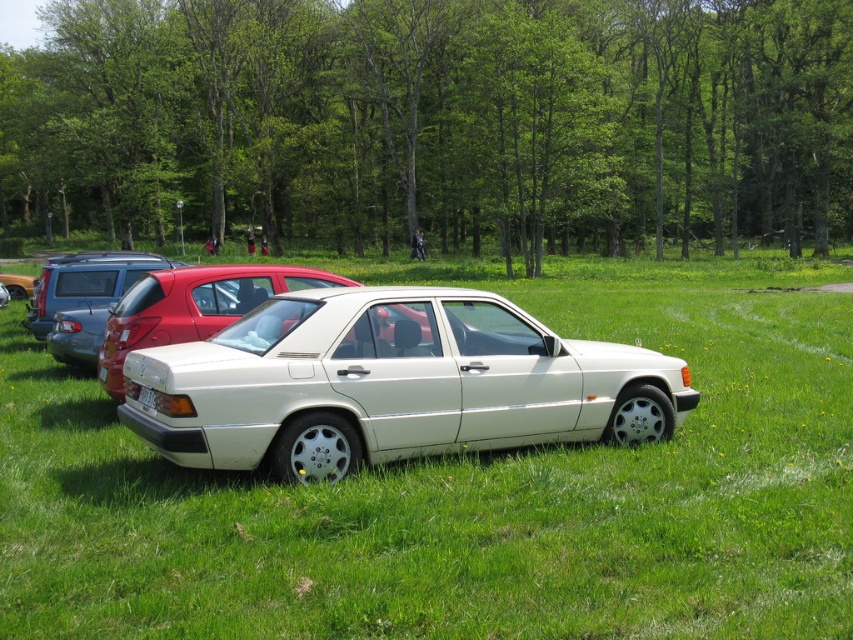
Question: Can you confirm if matte black hatchback at left is positioned to the right of white plastic license plate at center?

Choices:
 (A) no
 (B) yes

Answer: (A)

Question: Is white glossy sedan at center bigger than white metallic sedan at center?

Choices:
 (A) no
 (B) yes

Answer: (B)

Question: Estimate the real-world distances between objects in this image. Which object is closer to the satin white sedan at center?

Choices:
 (A) white metallic sedan at center
 (B) white plastic license plate at center
 (C) white glossy sedan at center
 (D) matte black hatchback at left

Answer: (A)

Question: Considering the real-world distances, which object is farthest from the white metallic sedan at center?

Choices:
 (A) matte black hatchback at left
 (B) white plastic license plate at center
 (C) white glossy sedan at center

Answer: (A)

Question: Can you confirm if white metallic sedan at center is positioned below white plastic license plate at center?

Choices:
 (A) yes
 (B) no

Answer: (B)

Question: Estimate the real-world distances between objects in this image. Which object is farther from the white metallic sedan at center?

Choices:
 (A) matte black hatchback at left
 (B) satin white sedan at center

Answer: (A)